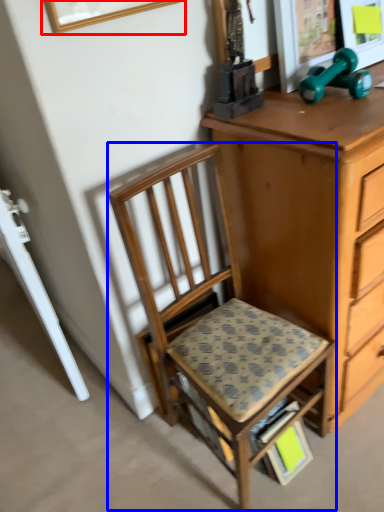
Question: Which of the following is the closest to the observer, picture frame (highlighted by a red box) or chair (highlighted by a blue box)?

Choices:
 (A) picture frame
 (B) chair

Answer: (A)